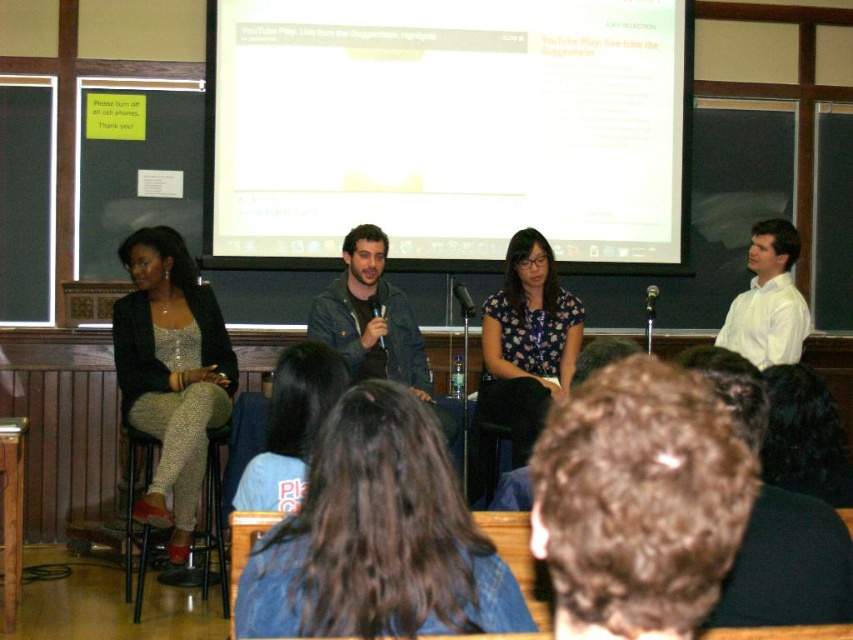
You are sitting in the audience and want to discreetly pass a note to the person wearing the sparkly silver pants at left and the denim jacket at center. Which one can you reach without leaving your seat?

The sparkly silver pants at left is closer to the viewer than the denim jacket at center, so you can reach the person wearing the sparkly silver pants at left without leaving your seat.

You are organizing a photo shoot in the lecture hall and need to place a wide camera on a tripod between the floral print blouse at center and the denim jacket at center. The camera requires 1.2 meters of space. Can the camera fit between them?

The floral print blouse at center is thinner than the denim jacket at center, but the exact distance between them isn not specified. Without knowing the actual space between the two, it is impossible to determine if the camera will fit.

You are an attendee at the event and want to greet both the person wearing the denim jacket at center and the person in the white smooth shirt at upper right. Which one should you approach first if you are standing at the entrance facing the stage?

The denim jacket at center is to the left of the white smooth shirt at upper right. Since you are facing the stage, the person wearing the denim jacket at center would be on your left side and closer to you, so you should approach them first.